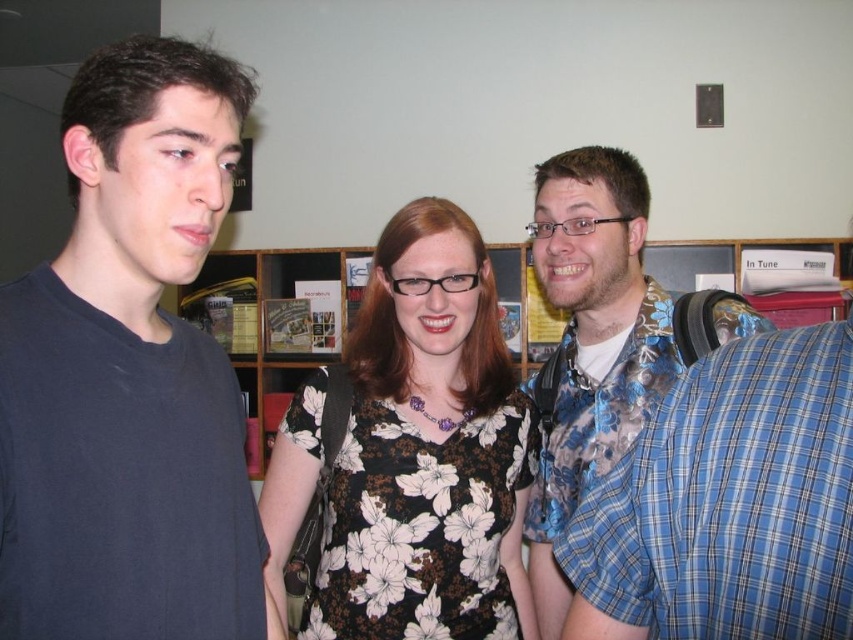
Between point (503, 624) and point (601, 307), which one is positioned behind?

Positioned behind is point (601, 307).

Can you confirm if floral fabric dress at center is positioned to the right of floral shirt at right?

Incorrect, floral fabric dress at center is not on the right side of floral shirt at right.

Is point (410, 513) farther from camera compared to point (547, 570)?

No, it is not.

The height and width of the screenshot is (640, 853). Identify the location of floral fabric dress at center. (427, 451).

Is dark blue t-shirt at left thinner than wooden bookshelf at center?

Correct, dark blue t-shirt at left's width is less than wooden bookshelf at center's.

Between dark blue t-shirt at left and wooden bookshelf at center, which one appears on the right side from the viewer's perspective?

From the viewer's perspective, dark blue t-shirt at left appears more on the right side.

Is point (119, 502) positioned after point (253, 440)?

No.

Identify the location of dark blue t-shirt at left. The width and height of the screenshot is (853, 640). (129, 374).

Which of these two, floral shirt at right or wooden bookshelf at center, stands shorter?

Standing shorter between the two is wooden bookshelf at center.

This screenshot has width=853, height=640. What do you see at coordinates (590, 342) in the screenshot?
I see `floral shirt at right` at bounding box center [590, 342].

Is point (564, 284) farther from viewer compared to point (822, 243)?

No, it is in front of (822, 243).

The image size is (853, 640). I want to click on floral shirt at right, so click(590, 342).